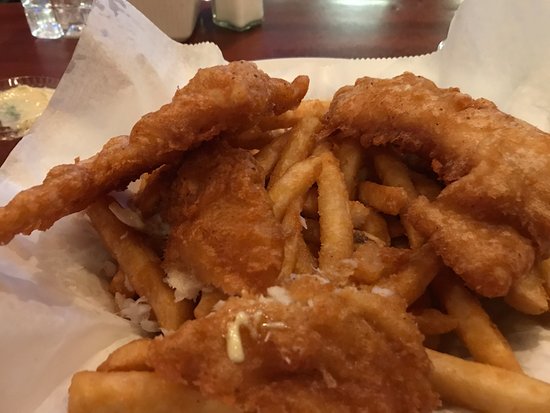
At what (x,y) coordinates should I click in order to perform the action: click on salt shaker. Please return your answer as a coordinate pair (x, y). The image size is (550, 413). Looking at the image, I should click on (236, 7).